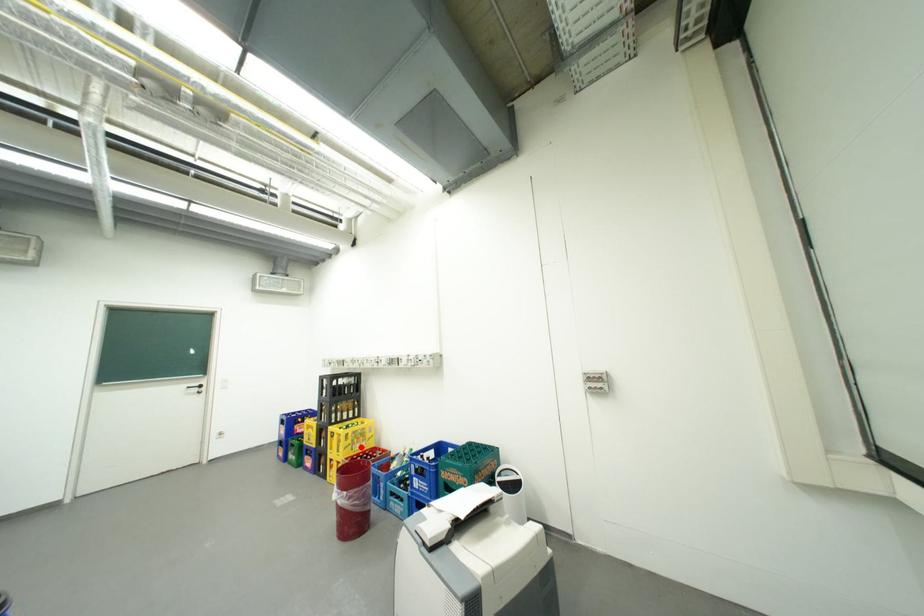
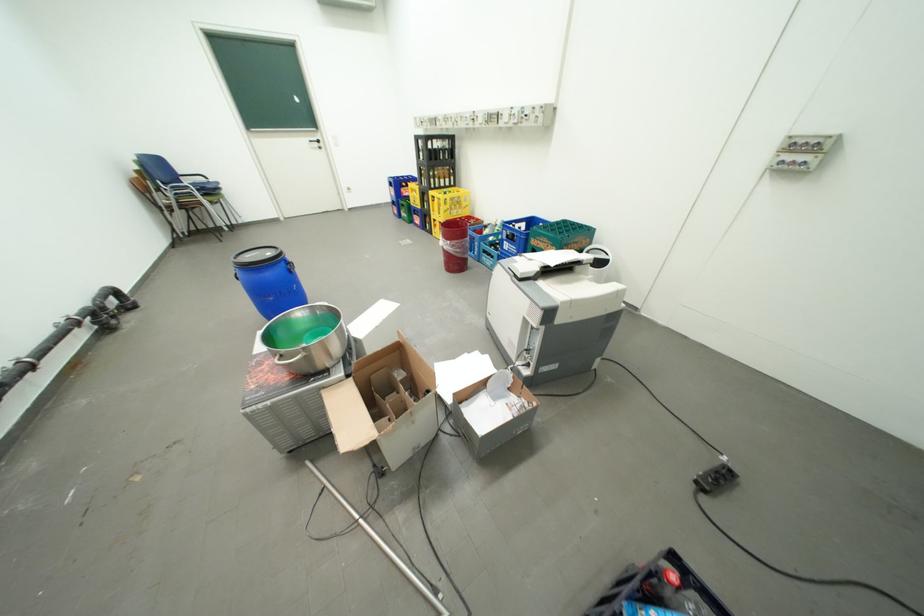
The point at the highlighted location is marked in the first image. Where is the corresponding point in the second image?

(459, 212)